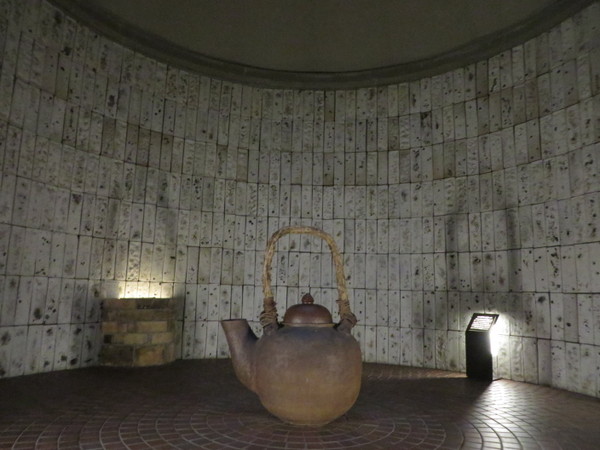
Image resolution: width=600 pixels, height=450 pixels. Identify the location of lights. (135, 297), (497, 326).